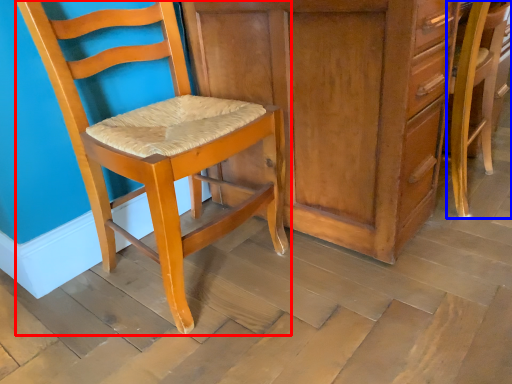
Question: Which object is further to the camera taking this photo, chair (highlighted by a red box) or chair (highlighted by a blue box)?

Choices:
 (A) chair
 (B) chair

Answer: (B)